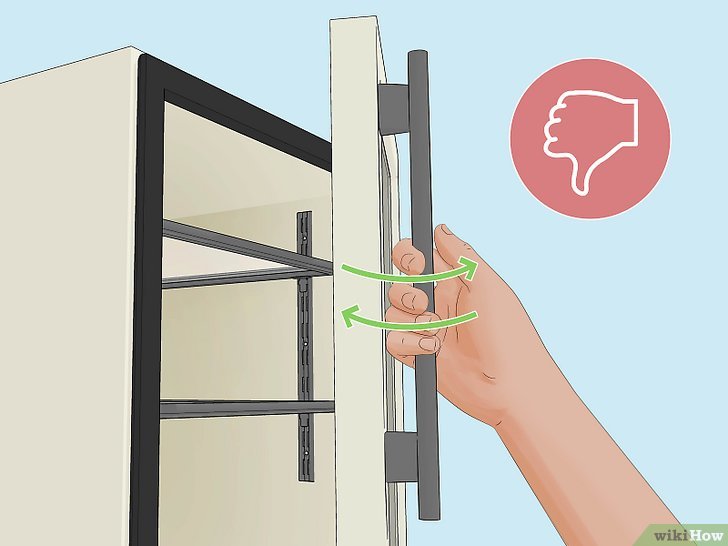
This screenshot has height=546, width=728. Identify the location of handle. (421, 156).